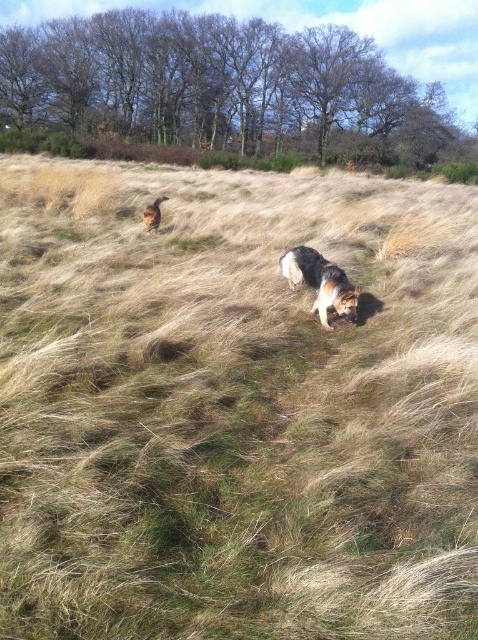
Which is below, black and tan fur dog at center or brown fur dog at upper center?

black and tan fur dog at center is lower down.

Is black and tan fur dog at center bigger than brown fur dog at upper center?

Yes.

Describe the element at coordinates (319, 282) in the screenshot. I see `black and tan fur dog at center` at that location.

Find the location of a particular element. This screenshot has height=640, width=478. black and tan fur dog at center is located at coordinates pyautogui.click(x=319, y=282).